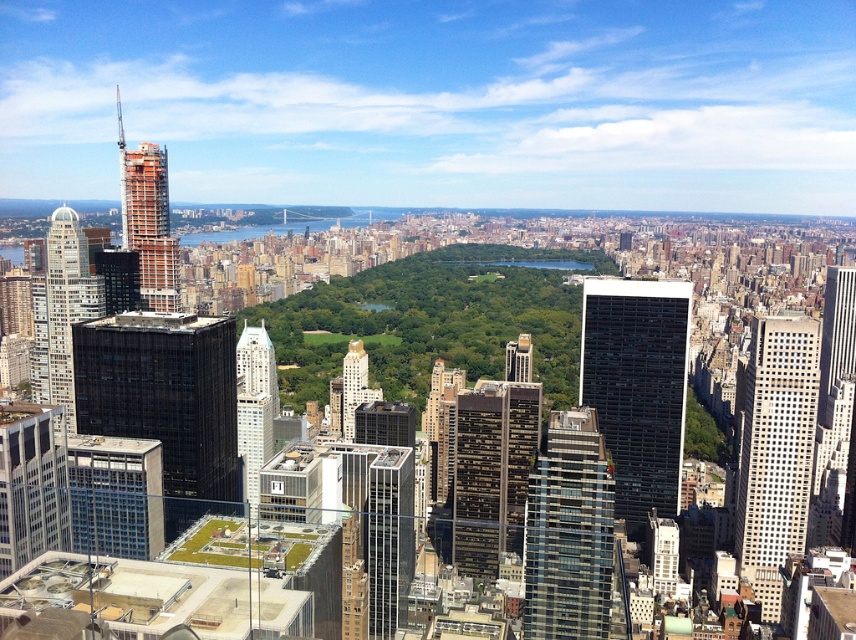
From the picture: You are standing at the observation deck of the Empire State Building and want to know how far the matte glass skyscraper at left is from you. Can you determine the distance?

The matte glass skyscraper at left is 696.29 meters away from the camera, so the distance from the observation deck of the Empire State Building to the matte glass skyscraper at left is approximately 696.29 meters.